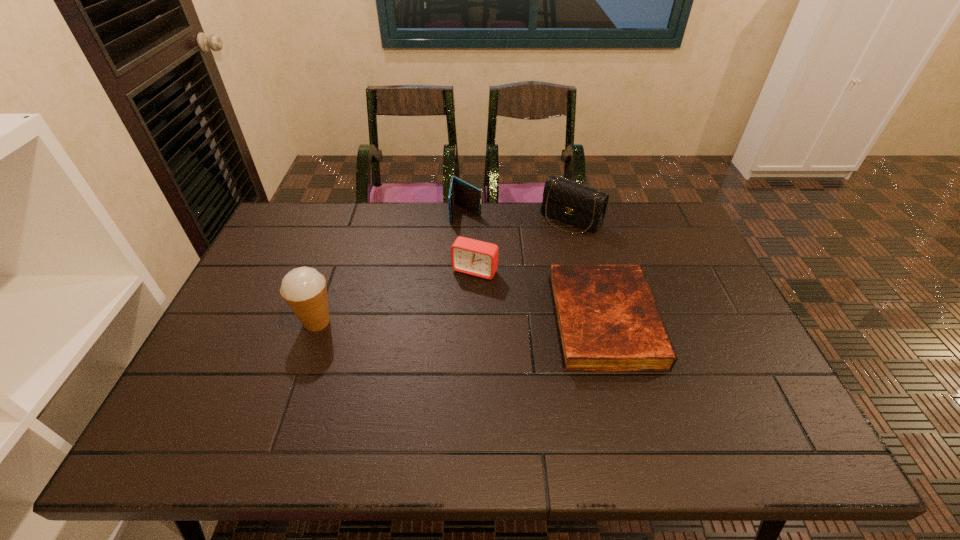
At what (x,y) coordinates should I click in order to perform the action: click on empty space that is in between the leftmost object and the wallet. Please return your answer as a coordinate pair (x, y). This screenshot has height=540, width=960. Looking at the image, I should click on (392, 267).

Locate an element on the screen. The height and width of the screenshot is (540, 960). blank region between the alarm clock and the shortest object is located at coordinates (540, 296).

Locate which object ranks in proximity to the leftmost object. Please provide its 2D coordinates. Your answer should be formatted as a tuple, i.e. [(x, y)], where the tuple contains the x and y coordinates of a point satisfying the conditions above.

[(469, 256)]

Locate which object ranks fourth in proximity to the shortest object. Please provide its 2D coordinates. Your answer should be formatted as a tuple, i.e. [(x, y)], where the tuple contains the x and y coordinates of a point satisfying the conditions above.

[(304, 289)]

Image resolution: width=960 pixels, height=540 pixels. Identify the location of free space that satisfies the following two spatial constraints: 1. on the back side of the Bible; 2. on the spine side of the icecream. (318, 321).

Locate an element on the screen. The image size is (960, 540). vacant position in the image that satisfies the following two spatial constraints: 1. on the front side of the wallet; 2. on the right side of the second tallest object is located at coordinates (466, 220).